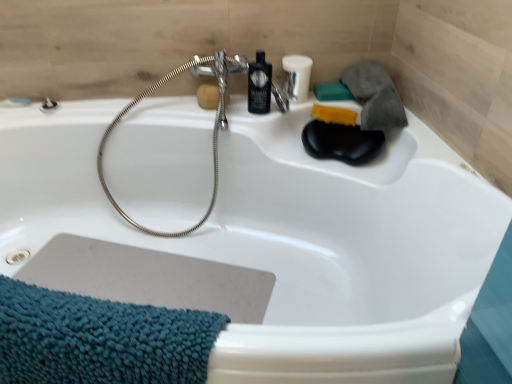
Measure the distance between brown sponge at upper center, positioned as the 3th soap in right-to-left order, and camera.

They are 4.83 feet apart.

You are a GUI agent. You are given a task and a screenshot of the screen. Output one action in this format:
    pyautogui.click(x=<x>, y=<y>)
    Task: Click on the black plastic mouthwash at upper center
    
    Given the screenshot: What is the action you would take?
    pyautogui.click(x=259, y=85)

Describe the element at coordinates (99, 339) in the screenshot. I see `teal chenille towel at lower left` at that location.

What do you see at coordinates (334, 115) in the screenshot? This screenshot has width=512, height=384. I see `yellow sponge at upper right, placed as the 2th soap when sorted from right to left` at bounding box center [334, 115].

Describe the element at coordinates (213, 128) in the screenshot. I see `silver metallic garden hose at upper center` at that location.

Based on the photo, how much space does teal matte soap at upper right, arranged as the first soap when viewed from the right, occupy horizontally?

It is 3.48 inches.

Measure the distance between point (335, 91) and camera.

The depth of point (335, 91) is 5.22 feet.

Image resolution: width=512 pixels, height=384 pixels. I want to click on brown sponge at upper center, positioned as the 3th soap in right-to-left order, so click(x=208, y=96).

Is teal chenille towel at lower left positioned before teal matte soap at upper right, which is the third soap in left-to-right order?

Yes, teal chenille towel at lower left is closer to the viewer.

Considering the relative sizes of teal chenille towel at lower left and teal matte soap at upper right, which is the third soap in left-to-right order, in the image provided, is teal chenille towel at lower left taller than teal matte soap at upper right, which is the third soap in left-to-right order,?

Correct, teal chenille towel at lower left is much taller as teal matte soap at upper right, which is the third soap in left-to-right order.

Is point (190, 313) in front of point (317, 90)?

Yes, point (190, 313) is in front of point (317, 90).

From a real-world perspective, is teal chenille towel at lower left on teal matte soap at upper right, arranged as the first soap when viewed from the right?

No, from a real-world perspective, teal chenille towel at lower left is not over teal matte soap at upper right, arranged as the first soap when viewed from the right

Looking at this image, does silver metallic garden hose at upper center turn towards matte black bottle at upper center?

No, silver metallic garden hose at upper center is not turned towards matte black bottle at upper center.

Between point (223, 58) and point (295, 62), which one is positioned behind?

The point (295, 62) is behind.

Where is `toiletry that appears above the silver metallic garden hose at upper center (from the image's perspective)`? toiletry that appears above the silver metallic garden hose at upper center (from the image's perspective) is located at coordinates (296, 77).

Who is taller, silver metallic garden hose at upper center or matte black bottle at upper center?

silver metallic garden hose at upper center.

Can you confirm if matte black bottle at upper center is smaller than teal chenille towel at lower left?

Correct, matte black bottle at upper center occupies less space than teal chenille towel at lower left.

Between matte black bottle at upper center and teal chenille towel at lower left, which one appears on the right side from the viewer's perspective?

From the viewer's perspective, matte black bottle at upper center appears more on the right side.

Is matte black bottle at upper center looking in the opposite direction of teal chenille towel at lower left?

No.

From the image's perspective, between teal chenille towel at lower left and brown sponge at upper center, positioned as the first soap in left-to-right order, who is located below?

teal chenille towel at lower left appears lower in the image.

In the image, is teal chenille towel at lower left positioned in front of or behind brown sponge at upper center, positioned as the 3th soap in right-to-left order?

Clearly, teal chenille towel at lower left is in front of brown sponge at upper center, positioned as the 3th soap in right-to-left order.

Which object is positioned more to the right, teal chenille towel at lower left or brown sponge at upper center, positioned as the 3th soap in right-to-left order?

Positioned to the right is brown sponge at upper center, positioned as the 3th soap in right-to-left order.

Does black plastic mouthwash at upper center have a larger size compared to brushed metal shower at upper left?

Yes.

I want to click on mouthwash above the brushed metal shower at upper left (from the image's perspective), so 259,85.

Which object is thinner, black plastic mouthwash at upper center or brushed metal shower at upper left?

brushed metal shower at upper left.

Who is more distant, black plastic mouthwash at upper center or brushed metal shower at upper left?

Positioned behind is brushed metal shower at upper left.

Which is further, (252, 95) or (321, 85)?

The point (321, 85) is farther.

Is black plastic mouthwash at upper center inside the boundaries of teal matte soap at upper right, arranged as the first soap when viewed from the right, or outside?

black plastic mouthwash at upper center is not enclosed by teal matte soap at upper right, arranged as the first soap when viewed from the right.

From a real-world perspective, which object rests below the other?

From a 3D spatial view, teal matte soap at upper right, which is the third soap in left-to-right order, is below.

Based on the photo, which object is positioned more to the right, black plastic mouthwash at upper center or teal matte soap at upper right, which is the third soap in left-to-right order?

teal matte soap at upper right, which is the third soap in left-to-right order.

Is teal matte soap at upper right, which is the third soap in left-to-right order, at the left side of black plastic mouthwash at upper center?

No, teal matte soap at upper right, which is the third soap in left-to-right order, is not to the left of black plastic mouthwash at upper center.

Is teal matte soap at upper right, arranged as the first soap when viewed from the right, in front of or behind black plastic mouthwash at upper center in the image?

In the image, teal matte soap at upper right, arranged as the first soap when viewed from the right, appears behind black plastic mouthwash at upper center.

In the scene shown: How far apart are teal matte soap at upper right, which is the third soap in left-to-right order, and black plastic mouthwash at upper center?

teal matte soap at upper right, which is the third soap in left-to-right order, is 27.41 centimeters from black plastic mouthwash at upper center.

Based on the photo, could you tell me if teal matte soap at upper right, arranged as the first soap when viewed from the right, is turned towards black plastic mouthwash at upper center?

No, teal matte soap at upper right, arranged as the first soap when viewed from the right, is not aimed at black plastic mouthwash at upper center.

The height and width of the screenshot is (384, 512). In order to click on the 2nd soap directly above the teal chenille towel at lower left (from a real-world perspective) in this screenshot , I will do `click(332, 92)`.

The height and width of the screenshot is (384, 512). I want to click on garden hose on the left of matte black bottle at upper center, so click(x=213, y=128).

Which object lies nearer to the anchor point matte black bottle at upper center, brown sponge at upper center, positioned as the first soap in left-to-right order, or teal chenille towel at lower left?

brown sponge at upper center, positioned as the first soap in left-to-right order, is positioned closer to the anchor matte black bottle at upper center.

Estimate the real-world distances between objects in this image. Which object is further from black plastic mouthwash at upper center, brushed metal shower at upper left or silver metallic garden hose at upper center?

Among the two, brushed metal shower at upper left is located further to black plastic mouthwash at upper center.

Which object lies nearer to the anchor point black plastic mouthwash at upper center, teal matte soap at upper right, arranged as the first soap when viewed from the right, or silver metallic garden hose at upper center?

silver metallic garden hose at upper center.

Considering their positions, is black plastic mouthwash at upper center positioned closer to brushed metal shower at upper left than matte black bottle at upper center?

black plastic mouthwash at upper center is positioned closer to the anchor brushed metal shower at upper left.

Which object lies further to the anchor point matte black bottle at upper center, yellow sponge at upper right, placed as the 2th soap when sorted from right to left, or silver metallic garden hose at upper center?

silver metallic garden hose at upper center is further to matte black bottle at upper center.

Estimate the real-world distances between objects in this image. Which object is further from brown sponge at upper center, positioned as the 3th soap in right-to-left order, teal chenille towel at lower left or teal matte soap at upper right, arranged as the first soap when viewed from the right?

teal chenille towel at lower left lies further to brown sponge at upper center, positioned as the 3th soap in right-to-left order, than the other object.

From the picture: Which object lies further to the anchor point teal matte soap at upper right, arranged as the first soap when viewed from the right, silver metallic garden hose at upper center or matte black bottle at upper center?

silver metallic garden hose at upper center is further to teal matte soap at upper right, arranged as the first soap when viewed from the right.

Considering their positions, is black plastic mouthwash at upper center positioned closer to matte black bottle at upper center than brown sponge at upper center, positioned as the first soap in left-to-right order?

Based on the image, black plastic mouthwash at upper center appears to be nearer to matte black bottle at upper center.

Find the location of `toiletry between brown sponge at upper center, positioned as the 3th soap in right-to-left order, and teal matte soap at upper right, which is the third soap in left-to-right order, in the horizontal direction`. toiletry between brown sponge at upper center, positioned as the 3th soap in right-to-left order, and teal matte soap at upper right, which is the third soap in left-to-right order, in the horizontal direction is located at coordinates (296, 77).

This screenshot has width=512, height=384. What are the coordinates of `mouthwash between brown sponge at upper center, positioned as the 3th soap in right-to-left order, and matte black bottle at upper center, in the horizontal direction` in the screenshot? It's located at (259, 85).

Locate an element on the screen. mouthwash between brushed metal shower at upper left and teal matte soap at upper right, which is the third soap in left-to-right order, in the horizontal direction is located at coordinates (259, 85).

Image resolution: width=512 pixels, height=384 pixels. What are the coordinates of `toiletry located between silver metallic garden hose at upper center and teal matte soap at upper right, which is the third soap in left-to-right order, in the left-right direction` in the screenshot? It's located at 296,77.